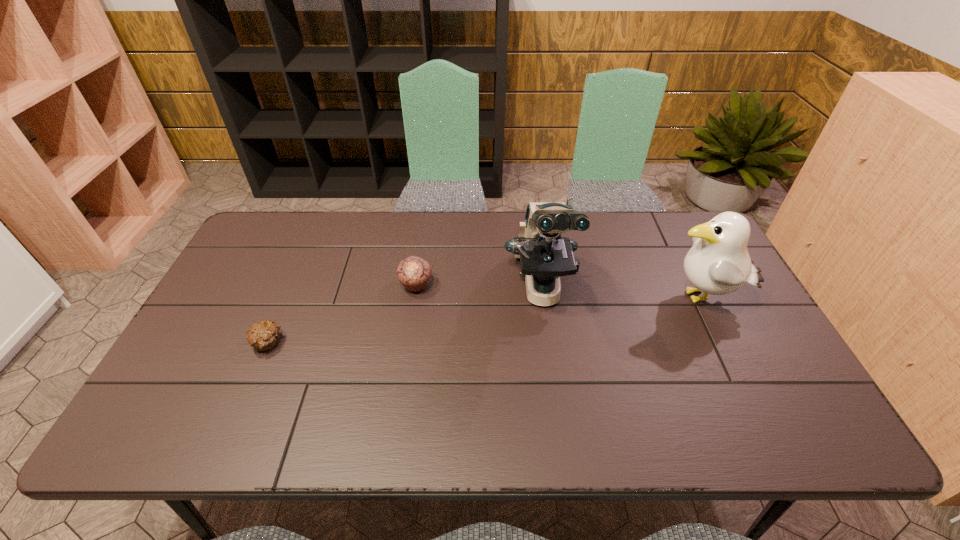
Locate an element on the screen. the second object from right to left is located at coordinates (544, 255).

I want to click on microscope, so click(x=544, y=255).

The width and height of the screenshot is (960, 540). I want to click on the third shortest object, so click(x=718, y=263).

Find the location of a particular element. The height and width of the screenshot is (540, 960). the rightmost object is located at coordinates (718, 263).

Identify the location of the third tallest object. Image resolution: width=960 pixels, height=540 pixels. (413, 272).

You are a GUI agent. You are given a task and a screenshot of the screen. Output one action in this format:
    pyautogui.click(x=<x>, y=<y>)
    Task: Click on the right muffin
    
    Given the screenshot: What is the action you would take?
    pyautogui.click(x=413, y=272)

Identify the location of the left muffin. (262, 336).

Locate an element on the screen. the shorter muffin is located at coordinates tap(262, 336).

Locate an element on the screen. This screenshot has height=540, width=960. free space located 0.160m through the eyepieces of the tallest object is located at coordinates (555, 385).

Where is `free region located on the beak of the gull`? free region located on the beak of the gull is located at coordinates (561, 298).